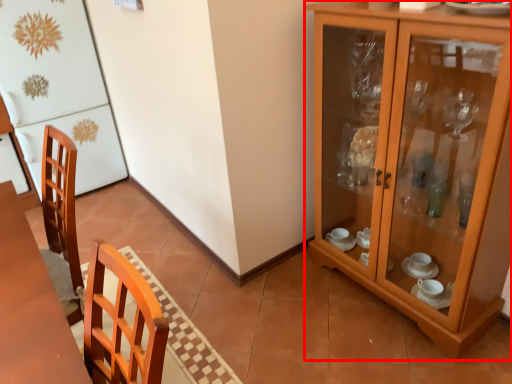
Question: Observing the image, what is the correct spatial positioning of cabinetry (annotated by the red box) in reference to fridge?

Choices:
 (A) right
 (B) left

Answer: (A)